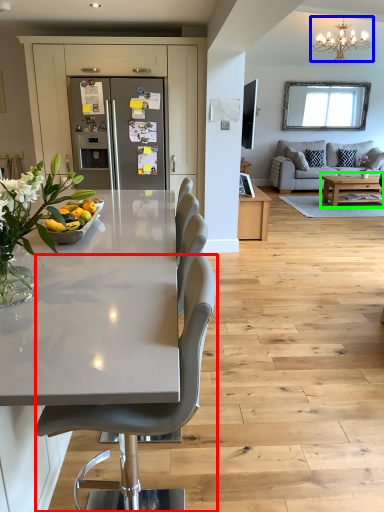
Question: Which object is the closest to the chair (highlighted by a red box)? Choose among these: light fixture (highlighted by a blue box) or coffee table (highlighted by a green box).

Choices:
 (A) light fixture
 (B) coffee table

Answer: (B)